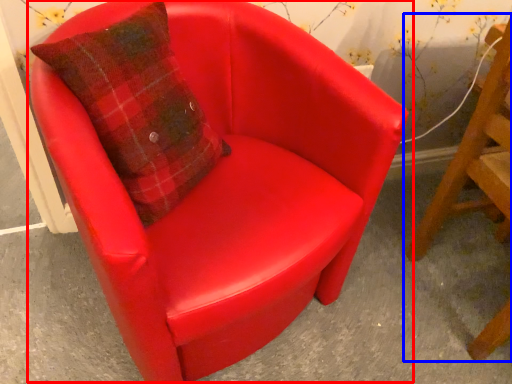
Question: Which object is closer to the camera taking this photo, chair (highlighted by a red box) or chair (highlighted by a blue box)?

Choices:
 (A) chair
 (B) chair

Answer: (A)